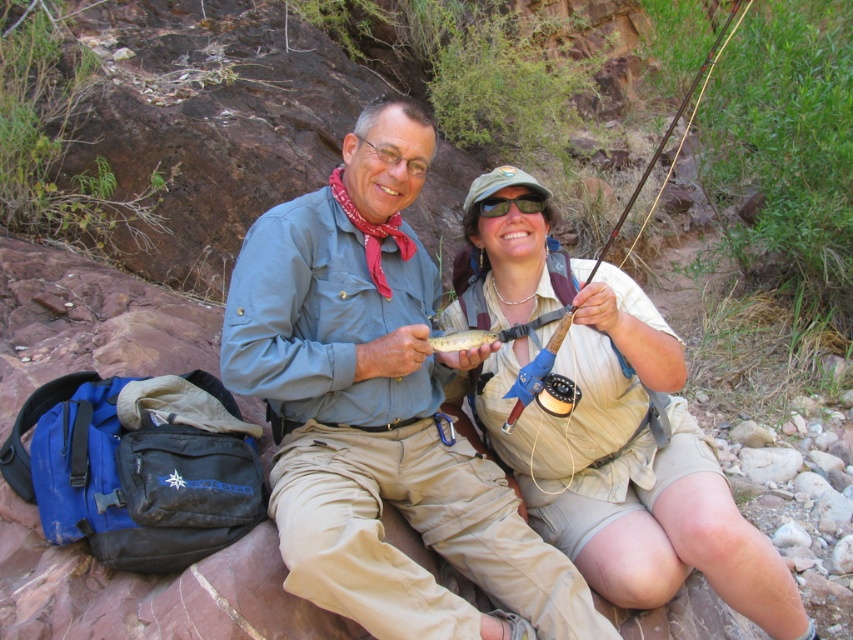
You are a photographer trying to capture the scene with the tan fabric shirt at center and the wooden fly rod at center. Which object would appear closer to the camera in your photo?

The tan fabric shirt at center is in front of the wooden fly rod at center, so it would appear closer to the camera in the photo.

You are a photographer standing at the edge of the rocky area. You want to take a photo that includes both the tan fabric shirt at center and the wooden fly rod at center. The camera you have can only focus on objects within a 28 inch range. Will both objects be in focus?

The distance between the tan fabric shirt at center and the wooden fly rod at center is 29.02 inches, which exceeds the camera focus range of 28 inches. Therefore, both objects cannot be in focus simultaneously.